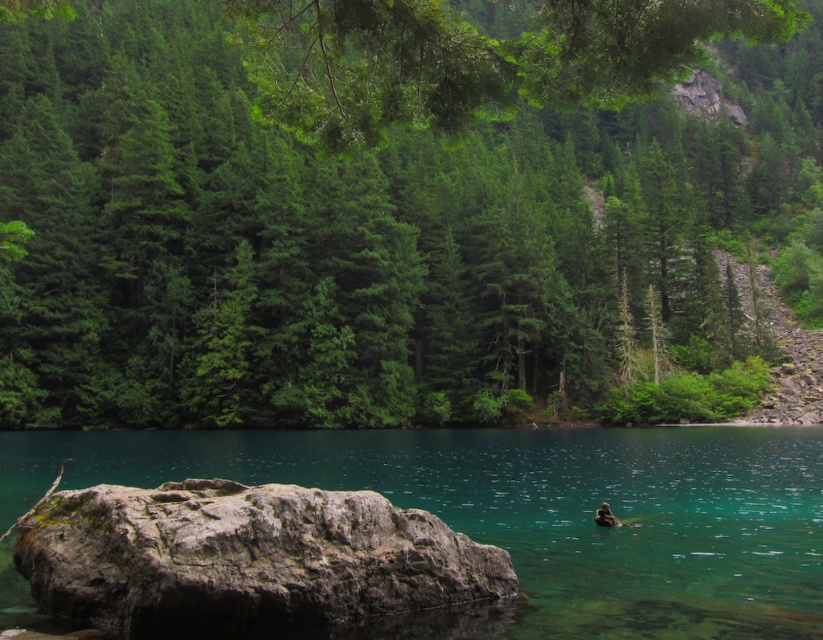
You are a hiker standing at the edge of the lake and want to take a photo of the green matte tree at center and the gray rough rock at lower left. Which object will appear larger in your camera viewfinder?

The green matte tree at center will appear larger in the camera viewfinder because it is bigger than the gray rough rock at lower left.

You are standing at the edge of the lake and want to determine which object in the scene is taller when viewed from your perspective. The objects are the clear glassy water at center and the gray rough rock at lower left. Which one is taller?

The clear glassy water at center is taller than the gray rough rock at lower left according to the description.